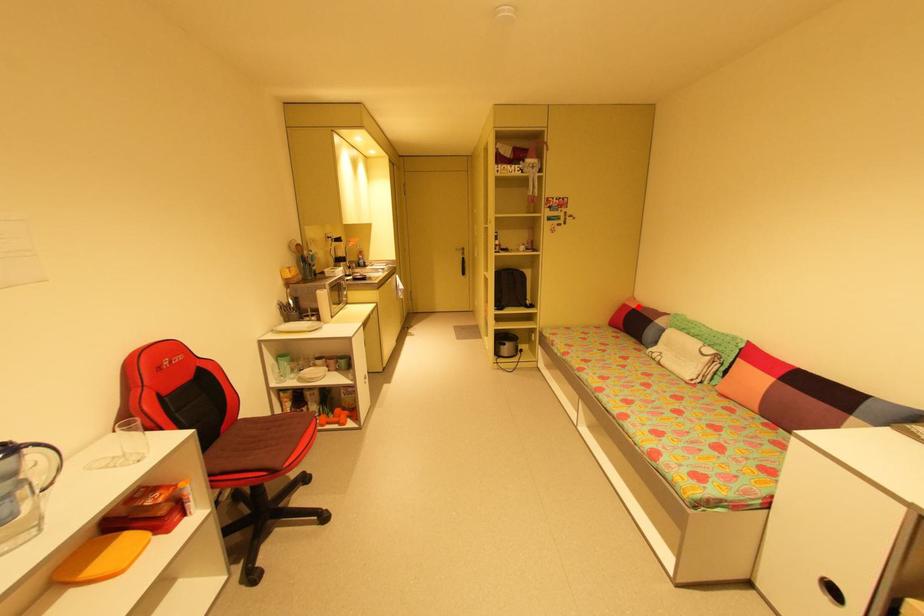
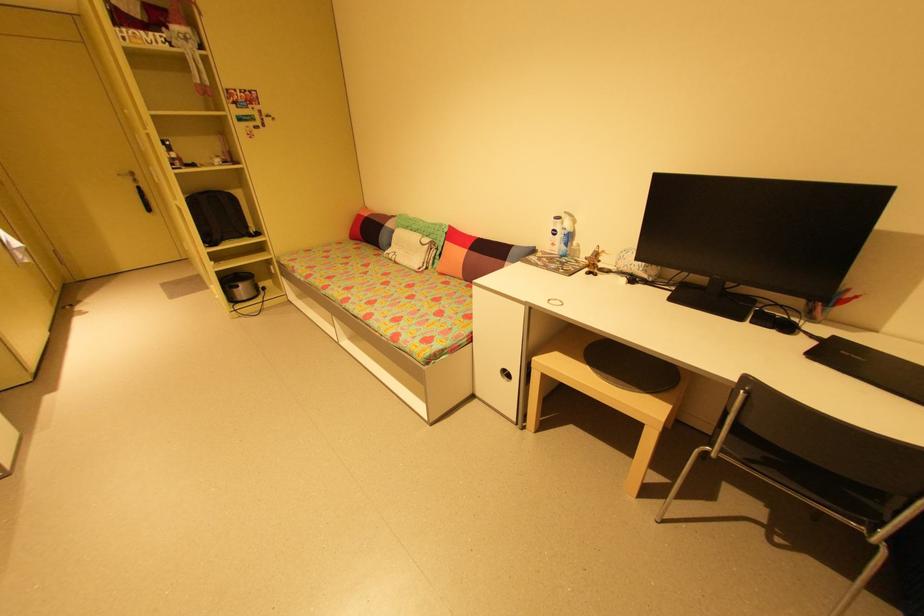
The point at the highlighted location is marked in the first image. Where is the corresponding point in the second image?

(371, 215)